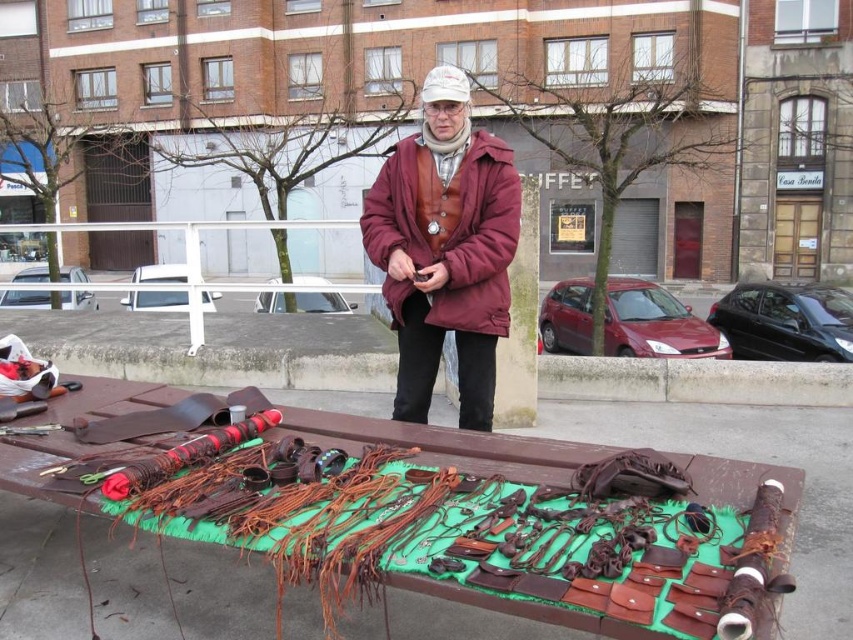
You are a customer at the outdoor market looking at the items on the brown leather table at center and the leather vest at center. Which item is positioned to the left?

The brown leather table at center is to the left of the leather vest at center.